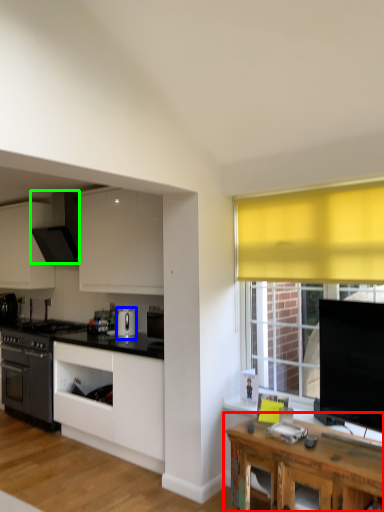
Question: Estimate the real-world distances between objects in this image. Which object is farther from table (highlighted by a red box), kitchen appliance (highlighted by a blue box) or kitchen appliance (highlighted by a green box)?

Choices:
 (A) kitchen appliance
 (B) kitchen appliance

Answer: (B)